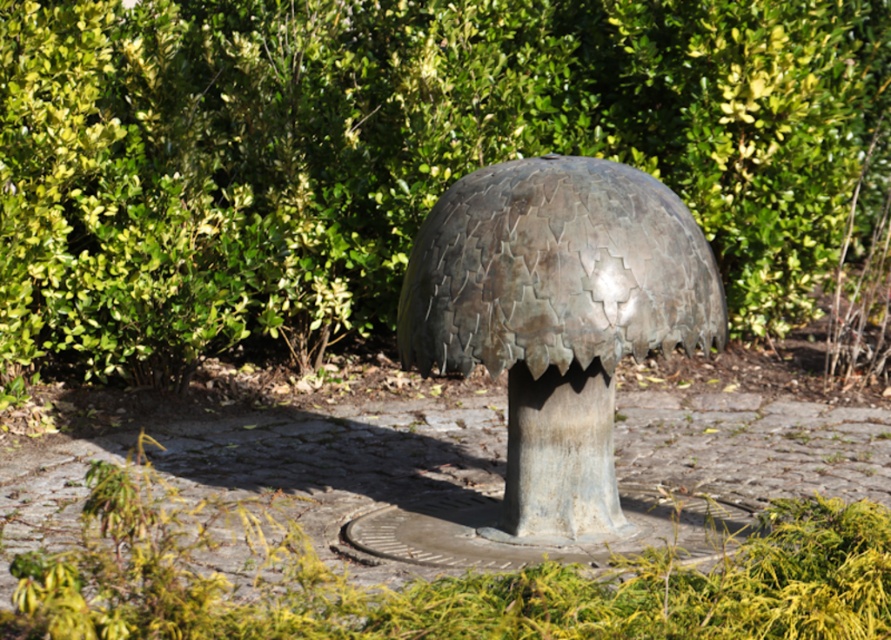
Question: Does green leafy bush at center appear on the right side of shiny metallic dome at center?

Choices:
 (A) yes
 (B) no

Answer: (B)

Question: Where is green leafy bush at center located in relation to shiny metallic dome at center in the image?

Choices:
 (A) above
 (B) below

Answer: (A)

Question: Can you confirm if green leafy bush at center is positioned to the right of shiny metallic dome at center?

Choices:
 (A) yes
 (B) no

Answer: (B)

Question: Which of the following is the closest to the observer?

Choices:
 (A) (585, 513)
 (B) (761, 192)

Answer: (A)